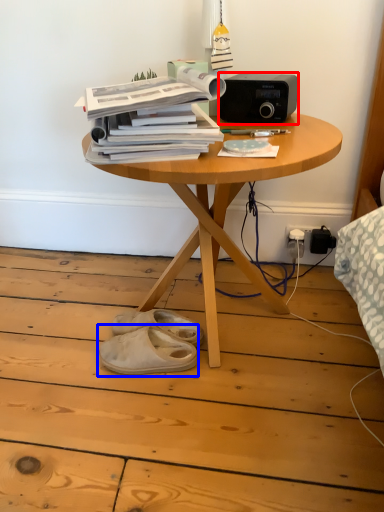
Question: Which object is closer to the camera taking this photo, stereo (highlighted by a red box) or footwear (highlighted by a blue box)?

Choices:
 (A) stereo
 (B) footwear

Answer: (A)